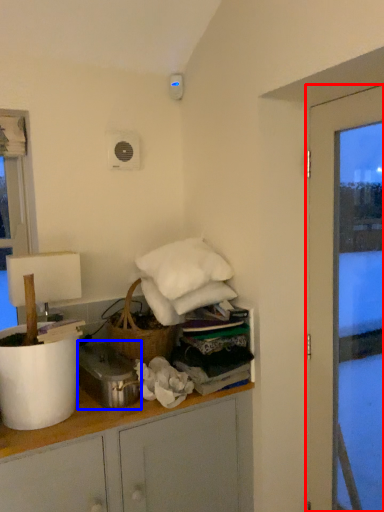
Question: Which object is closer to the camera taking this photo, door (highlighted by a red box) or appliance (highlighted by a blue box)?

Choices:
 (A) door
 (B) appliance

Answer: (A)